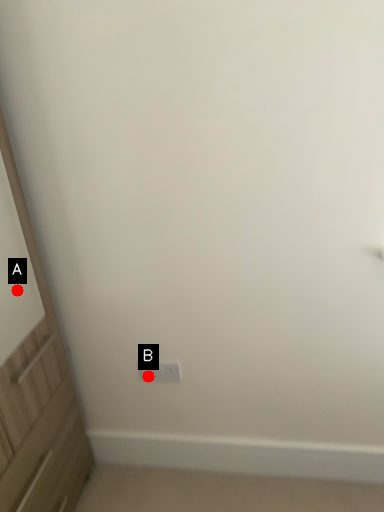
Question: Two points are circled on the image, labeled by A and B beside each circle. Among these points, which one is nearest to the camera?

Choices:
 (A) A is closer
 (B) B is closer

Answer: (A)